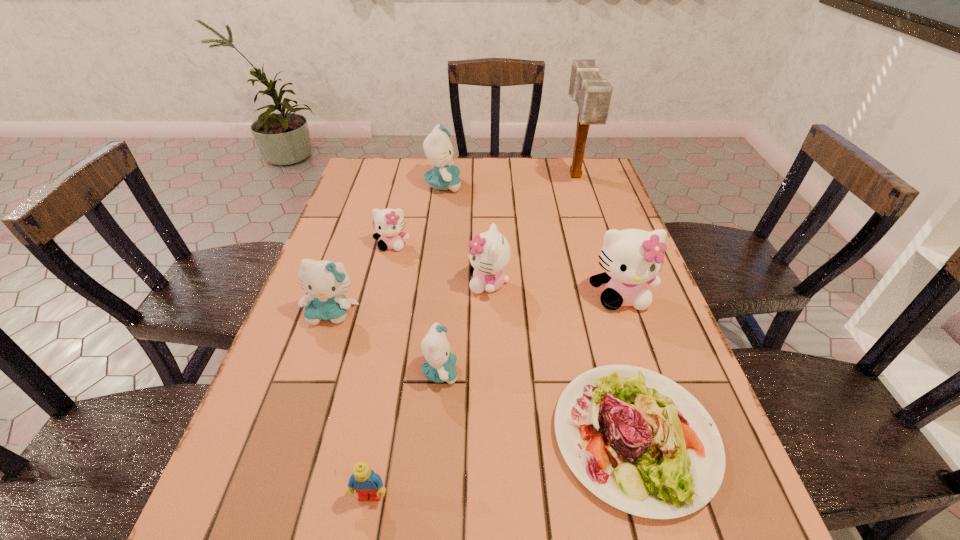
At what (x,y) coordinates should I click in order to perform the action: click on wood mallet. Please return your answer as a coordinate pair (x, y). The width and height of the screenshot is (960, 540). Looking at the image, I should click on (592, 94).

Where is `mallet`? The height and width of the screenshot is (540, 960). mallet is located at coordinates (592, 94).

The height and width of the screenshot is (540, 960). What are the coordinates of `the biggest blue kitten` in the screenshot? It's located at (437, 146).

Find the location of a particular element. Image resolution: width=960 pixels, height=540 pixels. the farthest kitten is located at coordinates (437, 146).

Locate an element on the screen. Image resolution: width=960 pixels, height=540 pixels. the biggest white kitten is located at coordinates (631, 258).

The height and width of the screenshot is (540, 960). Identify the location of the rightmost kitten. (631, 258).

This screenshot has height=540, width=960. Find the location of `the sixth object from left to right`. the sixth object from left to right is located at coordinates (490, 254).

Identify the location of the fifth kitten from left to right. This screenshot has height=540, width=960. (490, 254).

Find the location of `the second biggest blue kitten`. the second biggest blue kitten is located at coordinates (326, 282).

The image size is (960, 540). Find the location of `the second nearest blue kitten`. the second nearest blue kitten is located at coordinates point(326,282).